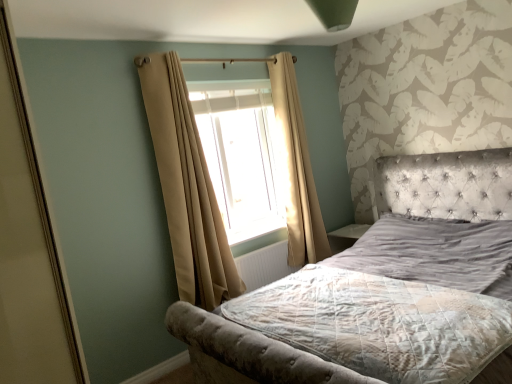
What do you see at coordinates (186, 187) in the screenshot? I see `beige fabric curtain at left, which is counted as the 2th curtain, starting from the back` at bounding box center [186, 187].

The height and width of the screenshot is (384, 512). What do you see at coordinates (380, 324) in the screenshot? I see `textured gray mattress at center` at bounding box center [380, 324].

At what (x,y) coordinates should I click in order to perform the action: click on velvet grey bed at center. Please return your answer as a coordinate pair (x, y). Looking at the image, I should click on (383, 292).

Describe the element at coordinates (296, 168) in the screenshot. I see `beige fabric curtain at center, which is the second curtain from left to right` at that location.

Where is `beige fabric curtain at left, the first curtain from the left`? beige fabric curtain at left, the first curtain from the left is located at coordinates (186, 187).

Is beige fabric curtain at center, which is counted as the first curtain, starting from the back, facing away from textured gray mattress at center?

beige fabric curtain at center, which is counted as the first curtain, starting from the back, does not have its back to textured gray mattress at center.

From a real-world perspective, between beige fabric curtain at center, the first curtain viewed from the right, and textured gray mattress at center, who is vertically higher?

In real-world perspective, beige fabric curtain at center, the first curtain viewed from the right, is above.

Between beige fabric curtain at center, the first curtain viewed from the right, and textured gray mattress at center, which one appears on the right side from the viewer's perspective?

textured gray mattress at center is more to the right.

From the image's perspective, is beige fabric curtain at center, the first curtain viewed from the right, below textured gray mattress at center?

Incorrect, from the image's perspective, beige fabric curtain at center, the first curtain viewed from the right, is higher than textured gray mattress at center.

From a real-world perspective, between beige fabric curtain at left, which is counted as the 2th curtain, starting from the back, and white textured radiator at center, who is vertically lower?

In real-world perspective, white textured radiator at center is lower.

Considering the sizes of objects beige fabric curtain at left, which is counted as the 2th curtain, starting from the back, and white textured radiator at center in the image provided, who is bigger, beige fabric curtain at left, which is counted as the 2th curtain, starting from the back, or white textured radiator at center?

beige fabric curtain at left, which is counted as the 2th curtain, starting from the back.

Does beige fabric curtain at left, the 2th curtain from the right, touch white textured radiator at center?

No.

From the picture: Between beige fabric curtain at left, the first curtain from the left, and white textured radiator at center, which one has larger width?

With larger width is beige fabric curtain at left, the first curtain from the left.

Which is behind, point (266, 293) or point (287, 268)?

Point (287, 268)

Considering the sizes of objects textured gray mattress at center and white textured radiator at center in the image provided, who is taller, textured gray mattress at center or white textured radiator at center?

white textured radiator at center.

From a real-world perspective, which object rests below the other?

white textured radiator at center is physically lower.

Are textured gray mattress at center and translucent fabric window at center located far from each other?

Yes, textured gray mattress at center and translucent fabric window at center are located far from each other.

Considering their positions, is textured gray mattress at center located in front of or behind translucent fabric window at center?

textured gray mattress at center is positioned closer to the viewer than translucent fabric window at center.

Considering the positions of points (362, 274) and (227, 108), is point (362, 274) closer to camera compared to point (227, 108)?

Yes, it is.

Considering the relative positions of textured gray mattress at center and translucent fabric window at center in the image provided, is textured gray mattress at center to the right of translucent fabric window at center from the viewer's perspective?

Correct, you'll find textured gray mattress at center to the right of translucent fabric window at center.

Is beige fabric curtain at left, which is counted as the 2th curtain, starting from the back, oriented away from beige fabric curtain at center, which is the second curtain from left to right?

That's not correct — beige fabric curtain at left, which is counted as the 2th curtain, starting from the back, is not looking away from beige fabric curtain at center, which is the second curtain from left to right.

How distant is beige fabric curtain at left, the first curtain from the left, from beige fabric curtain at center, which is the second curtain from left to right?

They are 36.70 inches apart.

Does beige fabric curtain at left, the 1th curtain when ordered from front to back, have a smaller size compared to beige fabric curtain at center, placed as the 2th curtain when sorted from front to back?

Correct, beige fabric curtain at left, the 1th curtain when ordered from front to back, occupies less space than beige fabric curtain at center, placed as the 2th curtain when sorted from front to back.

Considering the relative positions of beige fabric curtain at left, the 1th curtain when ordered from front to back, and beige fabric curtain at center, the first curtain viewed from the right, in the image provided, is beige fabric curtain at left, the 1th curtain when ordered from front to back, behind beige fabric curtain at center, the first curtain viewed from the right,?

No, it is not.

Does point (298, 218) come behind point (211, 304)?

Yes, it is.

Can you confirm if beige fabric curtain at center, which is counted as the first curtain, starting from the back, is thinner than beige fabric curtain at left, which is counted as the 2th curtain, starting from the back?

No, beige fabric curtain at center, which is counted as the first curtain, starting from the back, is not thinner than beige fabric curtain at left, which is counted as the 2th curtain, starting from the back.

From the image's perspective, would you say beige fabric curtain at center, which is counted as the first curtain, starting from the back, is shown under beige fabric curtain at left, the first curtain from the left?

Actually, beige fabric curtain at center, which is counted as the first curtain, starting from the back, appears above beige fabric curtain at left, the first curtain from the left, in the image.

Does beige fabric curtain at center, which is counted as the first curtain, starting from the back, appear on the right side of beige fabric curtain at left, the 1th curtain when ordered from front to back?

Yes.

Between beige fabric curtain at center, which is the second curtain from left to right, and velvet grey bed at center, which one is positioned in front?

velvet grey bed at center is in front.

Does point (288, 199) come behind point (459, 231)?

That is True.

Looking at this image, is beige fabric curtain at center, which is counted as the first curtain, starting from the back, oriented away from velvet grey bed at center?

No.

From a real-world perspective, starting from the textured gray mattress at center, which curtain is the 2nd one vertically above it? Please provide its 2D coordinates.

[(296, 168)]

Locate an element on the screen. radiator below the beige fabric curtain at left, which is counted as the 2th curtain, starting from the back (from a real-world perspective) is located at coordinates (264, 265).

When comparing their distances from beige fabric curtain at center, placed as the 2th curtain when sorted from front to back, does beige fabric curtain at left, the first curtain from the left, or velvet grey bed at center seem further?

Among the two, velvet grey bed at center is located further to beige fabric curtain at center, placed as the 2th curtain when sorted from front to back.

From the picture: Estimate the real-world distances between objects in this image. Which object is further from translucent fabric window at center, textured gray mattress at center or beige fabric curtain at left, the first curtain from the left?

textured gray mattress at center.

Based on their spatial positions, is beige fabric curtain at center, the first curtain viewed from the right, or translucent fabric window at center further from textured gray mattress at center?

Based on the image, translucent fabric window at center appears to be further to textured gray mattress at center.

When comparing their distances from white textured radiator at center, does translucent fabric window at center or beige fabric curtain at center, the first curtain viewed from the right, seem closer?

The object closer to white textured radiator at center is beige fabric curtain at center, the first curtain viewed from the right.

From the image, which object appears to be nearer to velvet grey bed at center, white textured radiator at center or textured gray mattress at center?

The object closer to velvet grey bed at center is textured gray mattress at center.

Which object lies nearer to the anchor point beige fabric curtain at left, the 1th curtain when ordered from front to back, velvet grey bed at center or textured gray mattress at center?

textured gray mattress at center is closer to beige fabric curtain at left, the 1th curtain when ordered from front to back.

From the image, which object appears to be nearer to white textured radiator at center, translucent fabric window at center or velvet grey bed at center?

The object closer to white textured radiator at center is translucent fabric window at center.

Looking at the image, which one is located further to beige fabric curtain at left, the 2th curtain from the right, translucent fabric window at center or white textured radiator at center?

translucent fabric window at center lies further to beige fabric curtain at left, the 2th curtain from the right, than the other object.

Identify the location of radiator between velvet grey bed at center and translucent fabric window at center from front to back. (264, 265).

The image size is (512, 384). I want to click on curtain between beige fabric curtain at center, the first curtain viewed from the right, and white textured radiator at center, in the vertical direction, so click(186, 187).

This screenshot has height=384, width=512. I want to click on curtain positioned between textured gray mattress at center and white textured radiator at center from near to far, so click(x=186, y=187).

Where is `radiator between textured gray mattress at center and translucent fabric window at center from front to back`? This screenshot has height=384, width=512. radiator between textured gray mattress at center and translucent fabric window at center from front to back is located at coordinates (264, 265).